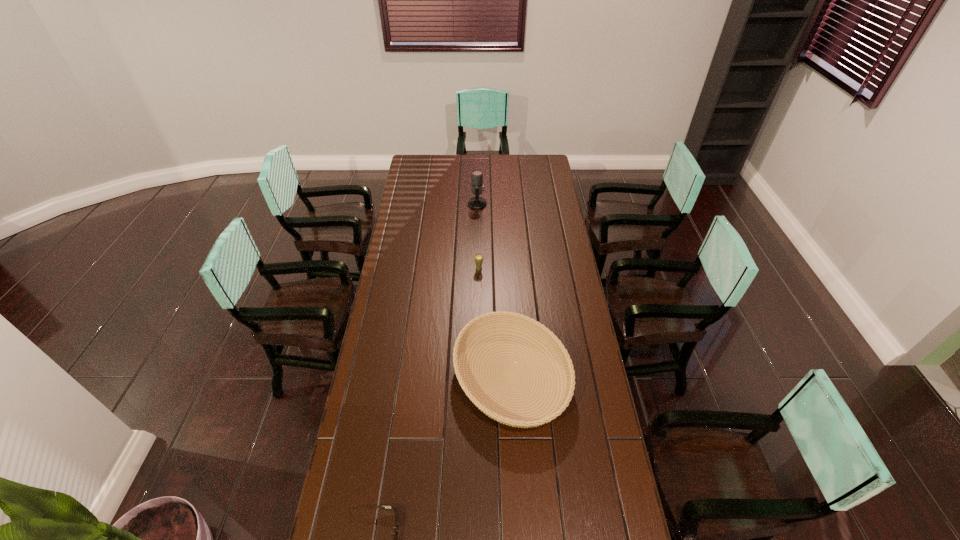
Image resolution: width=960 pixels, height=540 pixels. I want to click on object that is the second closest to the shortest object, so click(478, 258).

Identify which object is located as the second nearest to the third nearest object. Please provide its 2D coordinates. Your answer should be formatted as a tuple, i.e. [(x, y)], where the tuple contains the x and y coordinates of a point satisfying the conditions above.

[(477, 186)]

You are a GUI agent. You are given a task and a screenshot of the screen. Output one action in this format:
    pyautogui.click(x=<x>, y=<y>)
    Task: Click on the blank area in the image that satisfies the following two spatial constraints: 1. on the side of the second tallest object with the red ring; 2. on the right side of the tallest object
    The width and height of the screenshot is (960, 540).
    Given the screenshot: What is the action you would take?
    pyautogui.click(x=477, y=269)

Find the location of `free space that satisfies the following two spatial constraints: 1. on the side of the farthest object with the red ring; 2. on the back side of the third farthest object`. free space that satisfies the following two spatial constraints: 1. on the side of the farthest object with the red ring; 2. on the back side of the third farthest object is located at coordinates (476, 377).

Image resolution: width=960 pixels, height=540 pixels. I want to click on free space that satisfies the following two spatial constraints: 1. on the side of the farthest object with the red ring; 2. on the right side of the second nearest object, so click(x=476, y=377).

At what (x,y) coordinates should I click in order to perform the action: click on vacant region that satisfies the following two spatial constraints: 1. on the side of the tallest object with the red ring; 2. on the right side of the basket. Please return your answer as a coordinate pair (x, y). This screenshot has width=960, height=540. Looking at the image, I should click on (476, 377).